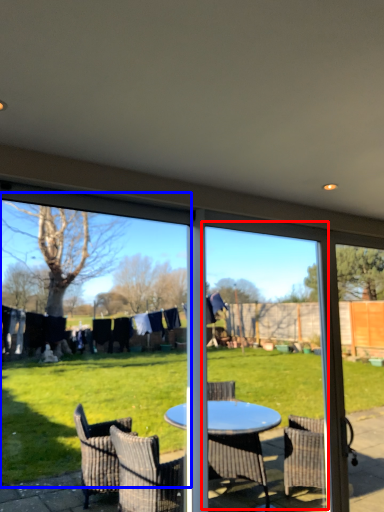
Question: Which of the following is the closest to the observer, screen door (highlighted by a red box) or window screen (highlighted by a blue box)?

Choices:
 (A) screen door
 (B) window screen

Answer: (B)